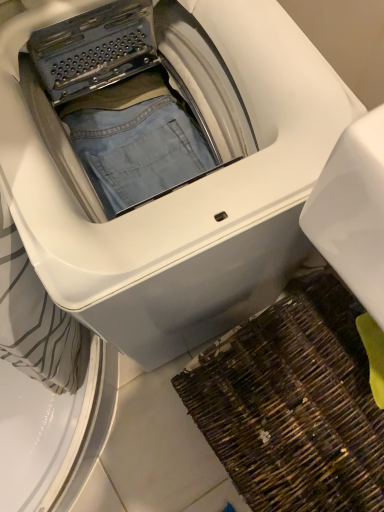
Question: From a real-world perspective, is brown woven mat at lower right above or below white glossy washing machine at center?

Choices:
 (A) below
 (B) above

Answer: (A)

Question: Is brown woven mat at lower right wider or thinner than white glossy washing machine at center?

Choices:
 (A) thin
 (B) wide

Answer: (A)

Question: In the image, is brown woven mat at lower right positioned in front of or behind white glossy washing machine at center?

Choices:
 (A) front
 (B) behind

Answer: (B)

Question: Based on their positions, is white glossy washing machine at center located to the left or right of brown woven mat at lower right?

Choices:
 (A) left
 (B) right

Answer: (A)

Question: Is point (244, 229) closer or farther from the camera than point (309, 392)?

Choices:
 (A) closer
 (B) farther

Answer: (A)

Question: Relative to brown woven mat at lower right, is white glossy washing machine at center in front or behind?

Choices:
 (A) front
 (B) behind

Answer: (A)

Question: Is white glossy washing machine at center taller or shorter than brown woven mat at lower right?

Choices:
 (A) short
 (B) tall

Answer: (B)